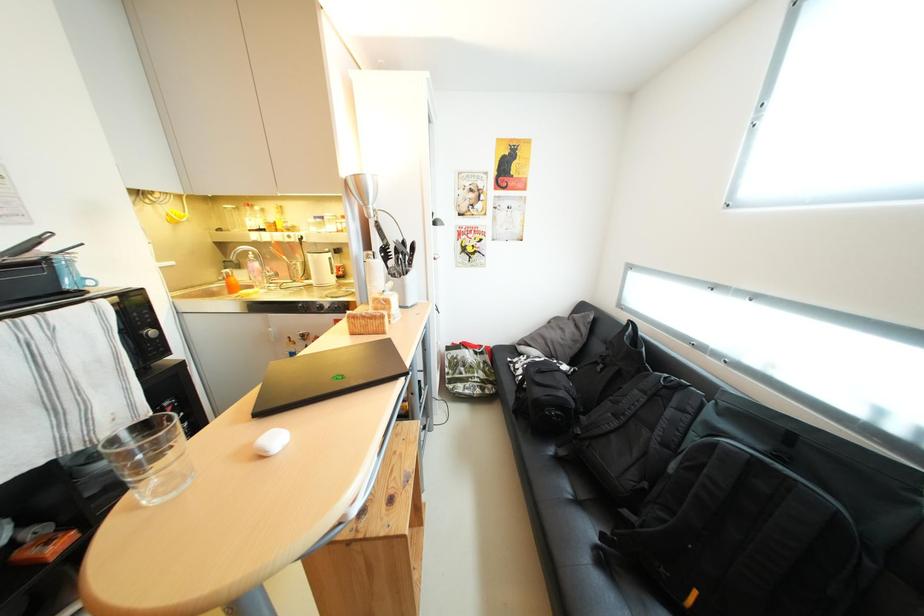
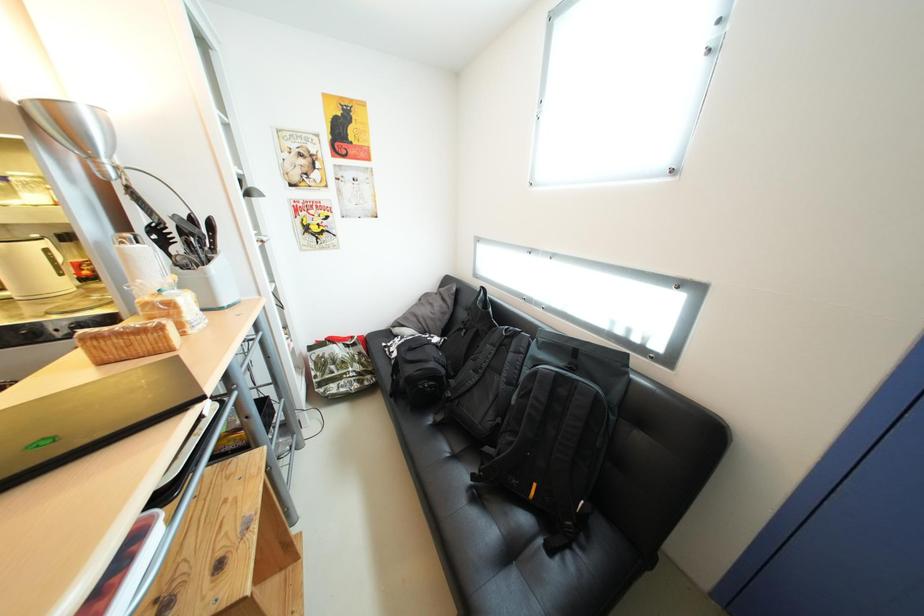
Question: The camera is either moving clockwise (left) or counter-clockwise (right) around the object. The first image is from the beginning of the video and the second image is from the end. Is the camera moving left or right when shooting the video?

Choices:
 (A) Left
 (B) Right

Answer: (A)